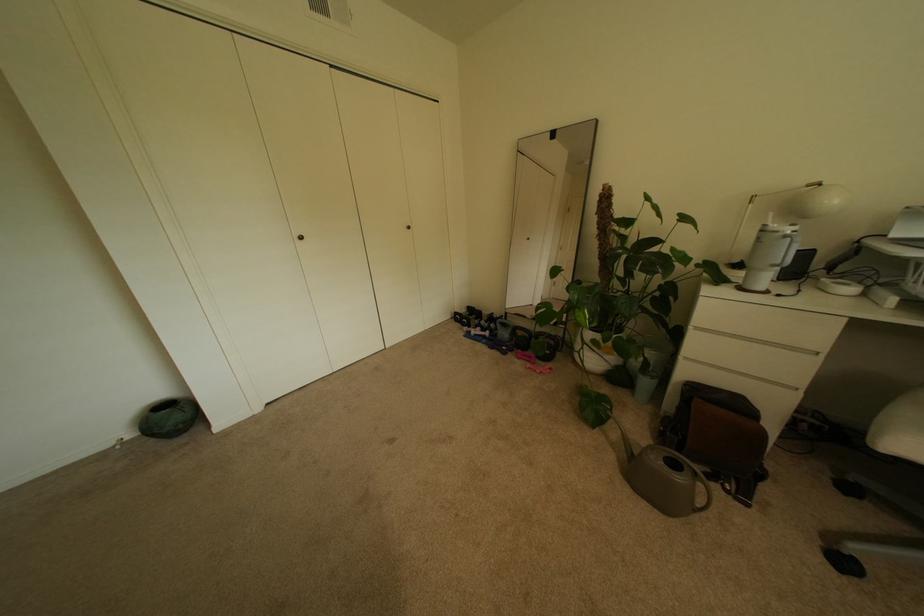
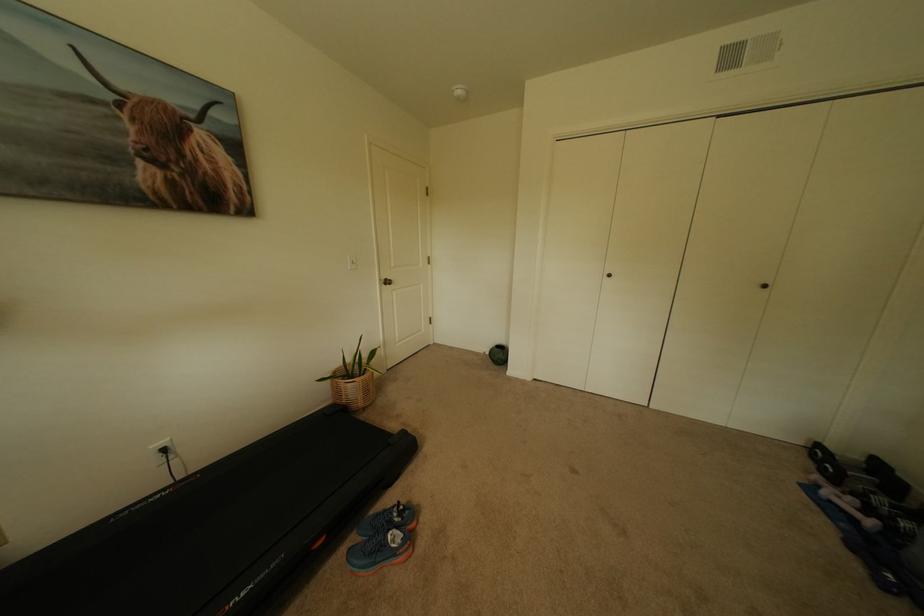
Where in the second image is the point corresponding to pixel 120 445 from the first image?

(491, 353)